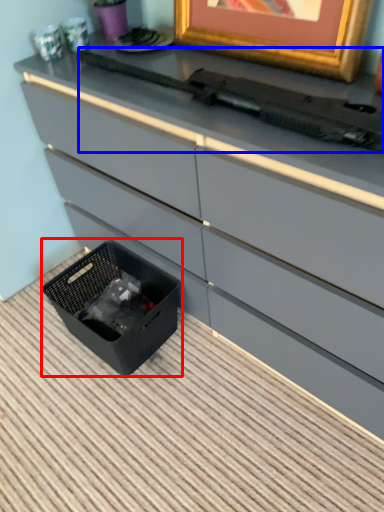
Question: Which object is closer to the camera taking this photo, storage box (highlighted by a red box) or typewriter (highlighted by a blue box)?

Choices:
 (A) storage box
 (B) typewriter

Answer: (B)